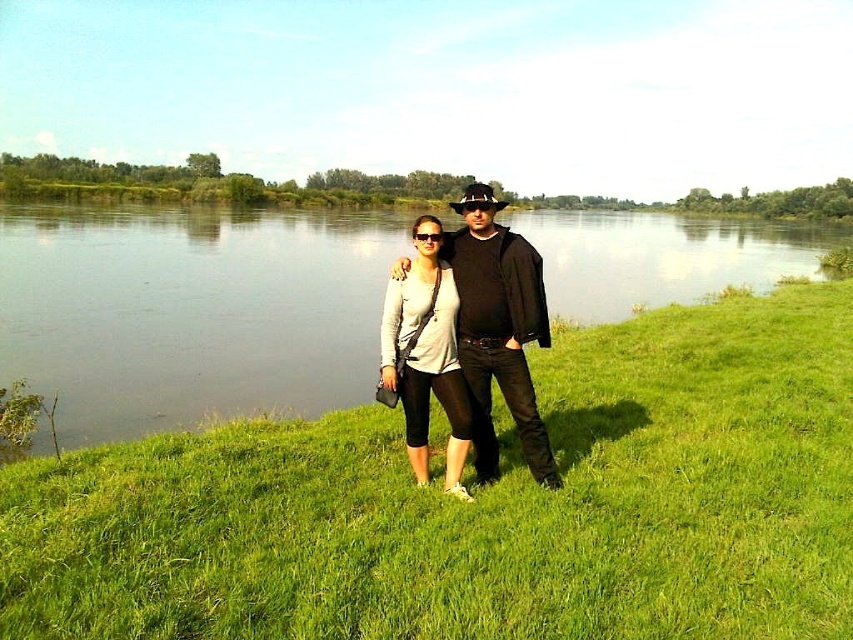
Does matte black jacket at center appear under matte white shirt at center?

Yes, matte black jacket at center is below matte white shirt at center.

Is matte black jacket at center positioned before matte white shirt at center?

Yes, matte black jacket at center is closer to the viewer.

Which is in front, point (479, 419) or point (445, 484)?

Point (445, 484)

This screenshot has width=853, height=640. I want to click on matte black jacket at center, so click(498, 328).

Who is taller, green grassy at center or matte black jacket at center?

matte black jacket at center is taller.

Does green grassy at center appear on the right side of matte black jacket at center?

Correct, you'll find green grassy at center to the right of matte black jacket at center.

This screenshot has width=853, height=640. What are the coordinates of `green grassy at center` in the screenshot? It's located at (480, 506).

Does matte black jacket at center appear over transparent plastic goggles at center?

No.

Does matte black jacket at center lie in front of transparent plastic goggles at center?

Yes.

Is point (479, 284) in front of point (422, 237)?

No, (479, 284) is behind (422, 237).

What are the coordinates of `matte black jacket at center` in the screenshot? It's located at (498, 328).